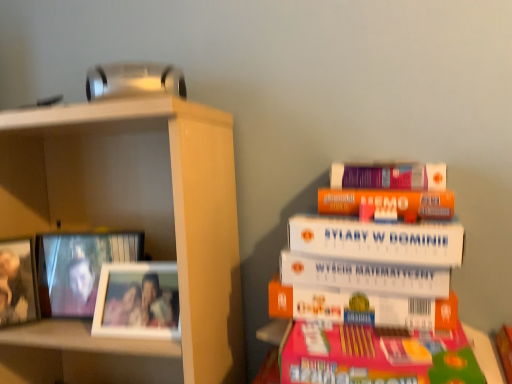
What are the coordinates of `wooden photo frame at left, the second picture frame from the right` in the screenshot? It's located at (79, 268).

Image resolution: width=512 pixels, height=384 pixels. What do you see at coordinates (79, 268) in the screenshot?
I see `wooden photo frame at left, the second picture frame from the right` at bounding box center [79, 268].

Find the location of `white matte book at upper right`. white matte book at upper right is located at coordinates (484, 263).

I want to click on metallic silver picture frame at left, positioned as the 1th picture frame in left-to-right order, so click(x=18, y=282).

Find the location of a particular element. wooden photo frame at left, which is counted as the second picture frame, starting from the left is located at coordinates (79, 268).

Could you tell me if wooden photo frame at left, the second picture frame from the right, is facing metallic silver picture frame at left, positioned as the 1th picture frame in left-to-right order?

No.

From a real-world perspective, between wooden photo frame at left, which is counted as the second picture frame, starting from the left, and metallic silver picture frame at left, acting as the 3th picture frame starting from the right, who is vertically higher?

metallic silver picture frame at left, acting as the 3th picture frame starting from the right.

Is wooden photo frame at left, the second picture frame from the right, inside the boundaries of metallic silver picture frame at left, positioned as the 1th picture frame in left-to-right order, or outside?

wooden photo frame at left, the second picture frame from the right, lies outside metallic silver picture frame at left, positioned as the 1th picture frame in left-to-right order.

In the image, is wooden photo frame at left, which is counted as the second picture frame, starting from the left, positioned in front of or behind metallic silver picture frame at left, acting as the 3th picture frame starting from the right?

Visually, wooden photo frame at left, which is counted as the second picture frame, starting from the left, is located behind metallic silver picture frame at left, acting as the 3th picture frame starting from the right.

How far apart are white matte picture frame at left, positioned as the first picture frame in right-to-left order, and white matte book at upper right?

21.03 inches.

Considering their positions, is white matte picture frame at left, which is counted as the 3th picture frame, starting from the left, located in front of or behind white matte book at upper right?

In the image, white matte picture frame at left, which is counted as the 3th picture frame, starting from the left, appears behind white matte book at upper right.

Is point (135, 281) in front of point (467, 280)?

Yes, it is in front of point (467, 280).

Considering the relative positions of metallic silver picture frame at left, acting as the 3th picture frame starting from the right, and white matte picture frame at left, positioned as the first picture frame in right-to-left order, in the image provided, is metallic silver picture frame at left, acting as the 3th picture frame starting from the right, to the right of white matte picture frame at left, positioned as the first picture frame in right-to-left order, from the viewer's perspective?

Incorrect, metallic silver picture frame at left, acting as the 3th picture frame starting from the right, is not on the right side of white matte picture frame at left, positioned as the first picture frame in right-to-left order.

Is metallic silver picture frame at left, positioned as the 1th picture frame in left-to-right order, located outside white matte picture frame at left, which is counted as the 3th picture frame, starting from the left?

Yes, metallic silver picture frame at left, positioned as the 1th picture frame in left-to-right order, is located beyond the bounds of white matte picture frame at left, which is counted as the 3th picture frame, starting from the left.

Looking at their sizes, would you say metallic silver picture frame at left, acting as the 3th picture frame starting from the right, is wider or thinner than white matte picture frame at left, positioned as the first picture frame in right-to-left order?

Clearly, metallic silver picture frame at left, acting as the 3th picture frame starting from the right, has more width compared to white matte picture frame at left, positioned as the first picture frame in right-to-left order.

Is metallic silver picture frame at left, positioned as the 1th picture frame in left-to-right order, taller or shorter than white matte picture frame at left, positioned as the first picture frame in right-to-left order?

In the image, metallic silver picture frame at left, positioned as the 1th picture frame in left-to-right order, appears to be taller than white matte picture frame at left, positioned as the first picture frame in right-to-left order.

The width and height of the screenshot is (512, 384). Identify the location of book on the right of metallic silver picture frame at left, positioned as the 1th picture frame in left-to-right order. (484, 263).

From a real-world perspective, is metallic silver picture frame at left, acting as the 3th picture frame starting from the right, below white matte book at upper right?

Correct, in the physical world, metallic silver picture frame at left, acting as the 3th picture frame starting from the right, is lower than white matte book at upper right.

Is metallic silver picture frame at left, acting as the 3th picture frame starting from the right, surrounding white matte book at upper right?

No, white matte book at upper right is not surrounded by metallic silver picture frame at left, acting as the 3th picture frame starting from the right.

Does wooden photo frame at left, the second picture frame from the right, have a lesser height compared to white matte book at upper right?

Yes, wooden photo frame at left, the second picture frame from the right, is shorter than white matte book at upper right.

In the scene shown: Is wooden photo frame at left, the second picture frame from the right, inside or outside of white matte book at upper right?

wooden photo frame at left, the second picture frame from the right, lies outside white matte book at upper right.

Is wooden photo frame at left, which is counted as the second picture frame, starting from the left, to the right of white matte book at upper right from the viewer's perspective?

No, wooden photo frame at left, which is counted as the second picture frame, starting from the left, is not to the right of white matte book at upper right.

Looking at this image, which object is thinner, metallic silver picture frame at left, positioned as the 1th picture frame in left-to-right order, or wooden photo frame at left, the second picture frame from the right?

wooden photo frame at left, the second picture frame from the right, is thinner.

Does point (1, 324) lie behind point (136, 234)?

That is False.

Would you say metallic silver picture frame at left, acting as the 3th picture frame starting from the right, is a long distance from wooden photo frame at left, which is counted as the second picture frame, starting from the left?

No.

Is white matte picture frame at left, positioned as the first picture frame in right-to-left order, to the left of metallic silver picture frame at left, positioned as the 1th picture frame in left-to-right order, from the viewer's perspective?

No.

Is white matte picture frame at left, which is counted as the 3th picture frame, starting from the left, aimed at metallic silver picture frame at left, positioned as the 1th picture frame in left-to-right order?

No, white matte picture frame at left, which is counted as the 3th picture frame, starting from the left, is not aimed at metallic silver picture frame at left, positioned as the 1th picture frame in left-to-right order.

Between white matte picture frame at left, positioned as the first picture frame in right-to-left order, and metallic silver picture frame at left, acting as the 3th picture frame starting from the right, which one has larger width?

metallic silver picture frame at left, acting as the 3th picture frame starting from the right, is wider.

Which is correct: white matte picture frame at left, positioned as the first picture frame in right-to-left order, is inside metallic silver picture frame at left, acting as the 3th picture frame starting from the right, or outside of it?

white matte picture frame at left, positioned as the first picture frame in right-to-left order, is not enclosed by metallic silver picture frame at left, acting as the 3th picture frame starting from the right.

Where is `picture frame that is the 1st one when counting forward from the wooden photo frame at left, which is counted as the second picture frame, starting from the left`? This screenshot has width=512, height=384. picture frame that is the 1st one when counting forward from the wooden photo frame at left, which is counted as the second picture frame, starting from the left is located at coordinates (18, 282).

The width and height of the screenshot is (512, 384). Find the location of `the 1st picture frame counting from the left of the white matte book at upper right`. the 1st picture frame counting from the left of the white matte book at upper right is located at coordinates (138, 301).

Which object lies further to the anchor point white matte picture frame at left, which is counted as the 3th picture frame, starting from the left, wooden photo frame at left, the second picture frame from the right, or white matte book at upper right?

white matte book at upper right.

Looking at the image, which one is located closer to wooden photo frame at left, the second picture frame from the right, metallic silver picture frame at left, acting as the 3th picture frame starting from the right, or white matte book at upper right?

The object closer to wooden photo frame at left, the second picture frame from the right, is metallic silver picture frame at left, acting as the 3th picture frame starting from the right.

Looking at the image, which one is located closer to metallic silver picture frame at left, positioned as the 1th picture frame in left-to-right order, white matte book at upper right or white matte picture frame at left, which is counted as the 3th picture frame, starting from the left?

The object closer to metallic silver picture frame at left, positioned as the 1th picture frame in left-to-right order, is white matte picture frame at left, which is counted as the 3th picture frame, starting from the left.

Based on their spatial positions, is metallic silver picture frame at left, acting as the 3th picture frame starting from the right, or white matte picture frame at left, positioned as the first picture frame in right-to-left order, closer to wooden photo frame at left, which is counted as the second picture frame, starting from the left?

metallic silver picture frame at left, acting as the 3th picture frame starting from the right, lies closer to wooden photo frame at left, which is counted as the second picture frame, starting from the left, than the other object.

Which object lies further to the anchor point metallic silver picture frame at left, acting as the 3th picture frame starting from the right, white matte book at upper right or wooden photo frame at left, the second picture frame from the right?

white matte book at upper right is positioned further to the anchor metallic silver picture frame at left, acting as the 3th picture frame starting from the right.

Based on their spatial positions, is white matte book at upper right or metallic silver picture frame at left, acting as the 3th picture frame starting from the right, closer to wooden photo frame at left, the second picture frame from the right?

metallic silver picture frame at left, acting as the 3th picture frame starting from the right.

Estimate the real-world distances between objects in this image. Which object is closer to white matte picture frame at left, positioned as the first picture frame in right-to-left order, white matte book at upper right or wooden photo frame at left, which is counted as the second picture frame, starting from the left?

wooden photo frame at left, which is counted as the second picture frame, starting from the left, is positioned closer to the anchor white matte picture frame at left, positioned as the first picture frame in right-to-left order.

Looking at the image, which one is located closer to white matte picture frame at left, positioned as the first picture frame in right-to-left order, metallic silver picture frame at left, acting as the 3th picture frame starting from the right, or wooden photo frame at left, which is counted as the second picture frame, starting from the left?

The object closer to white matte picture frame at left, positioned as the first picture frame in right-to-left order, is wooden photo frame at left, which is counted as the second picture frame, starting from the left.

Where is `picture frame located between metallic silver picture frame at left, positioned as the 1th picture frame in left-to-right order, and white matte picture frame at left, which is counted as the 3th picture frame, starting from the left, in the left-right direction`? The width and height of the screenshot is (512, 384). picture frame located between metallic silver picture frame at left, positioned as the 1th picture frame in left-to-right order, and white matte picture frame at left, which is counted as the 3th picture frame, starting from the left, in the left-right direction is located at coordinates (79, 268).

I want to click on picture frame between wooden photo frame at left, the second picture frame from the right, and white matte book at upper right, so click(x=138, y=301).